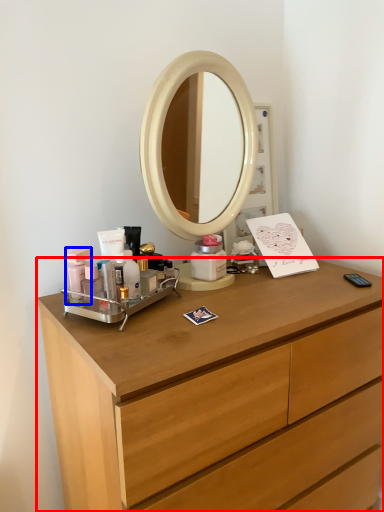
Question: Which point is further to the camera, chest of drawers (highlighted by a red box) or toiletry (highlighted by a blue box)?

Choices:
 (A) chest of drawers
 (B) toiletry

Answer: (B)